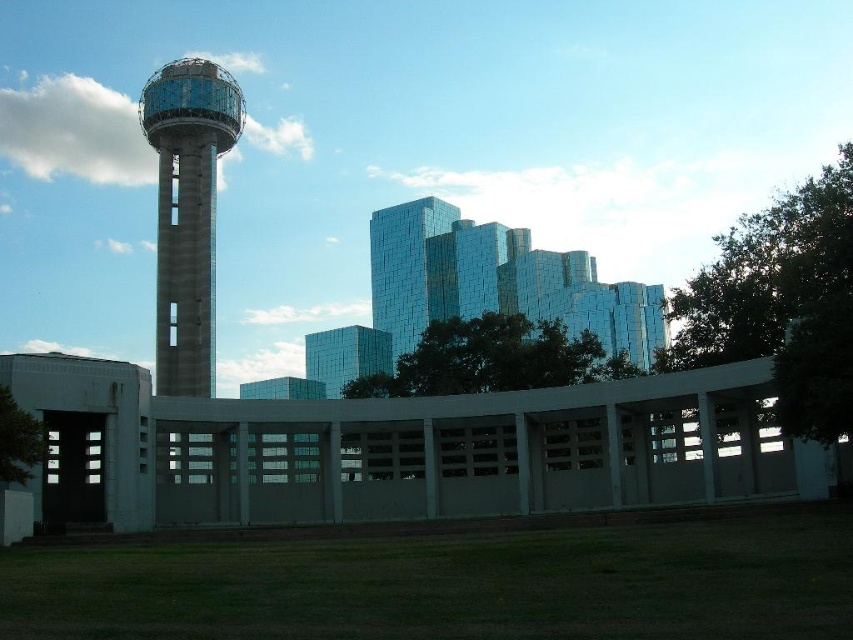
Question: Does concrete water tower at left appear over glossy glass building at center?

Choices:
 (A) yes
 (B) no

Answer: (A)

Question: Is concrete water tower at left thinner than glossy glass building at center?

Choices:
 (A) yes
 (B) no

Answer: (A)

Question: Where is concrete water tower at left located in relation to glossy glass building at center in the image?

Choices:
 (A) right
 (B) left

Answer: (B)

Question: Which point is closer to the camera?

Choices:
 (A) glossy glass building at center
 (B) concrete water tower at left

Answer: (B)

Question: Which of the following is the farthest from the observer?

Choices:
 (A) (161, 301)
 (B) (427, 237)

Answer: (B)